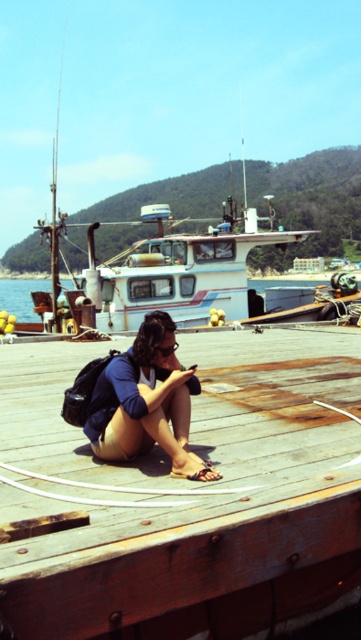
Question: Does matte blue shorts at center appear on the left side of clear blue water at lower left?

Choices:
 (A) no
 (B) yes

Answer: (A)

Question: Among these objects, which one is farthest from the camera?

Choices:
 (A) clear blue water at lower left
 (B) wooden at center
 (C) matte blue shorts at center

Answer: (A)

Question: Considering the real-world distances, which object is closest to the wooden at center?

Choices:
 (A) clear blue water at lower left
 (B) matte blue shorts at center

Answer: (B)

Question: Can you confirm if wooden at center is smaller than clear blue water at lower left?

Choices:
 (A) no
 (B) yes

Answer: (B)

Question: Is wooden at center below matte blue shorts at center?

Choices:
 (A) no
 (B) yes

Answer: (B)

Question: Estimate the real-world distances between objects in this image. Which object is closer to the clear blue water at lower left?

Choices:
 (A) wooden at center
 (B) matte blue shorts at center

Answer: (B)